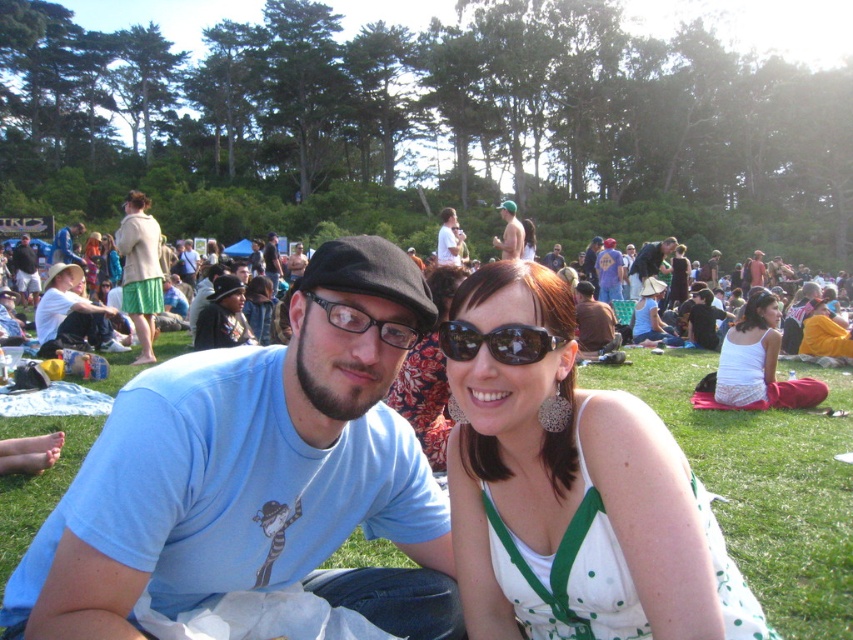
Is point (469, 349) farther from camera compared to point (506, 236)?

No, (469, 349) is closer to viewer.

Is black reflective sunglasses at center taller than skinny man at center?

Incorrect, black reflective sunglasses at center's height is not larger of skinny man at center's.

Who is more distant from viewer, (451, 324) or (514, 237)?

The point (514, 237) is behind.

Locate an element on the screen. black reflective sunglasses at center is located at coordinates (496, 340).

Is point (248, 388) less distant than point (416, 333)?

Yes.

Can you confirm if light blue t-shirt at center is wider than matte black glasses at center?

Indeed, light blue t-shirt at center has a greater width compared to matte black glasses at center.

Who is more forward, (331, 531) or (328, 305)?

Positioned in front is point (328, 305).

Image resolution: width=853 pixels, height=640 pixels. I want to click on light blue t-shirt at center, so click(254, 476).

Which is behind, point (596, 326) or point (109, 259)?

Point (109, 259)

Is point (590, 355) positioned in front of point (113, 266)?

Yes.

I want to click on brown leather jacket at center, so click(593, 323).